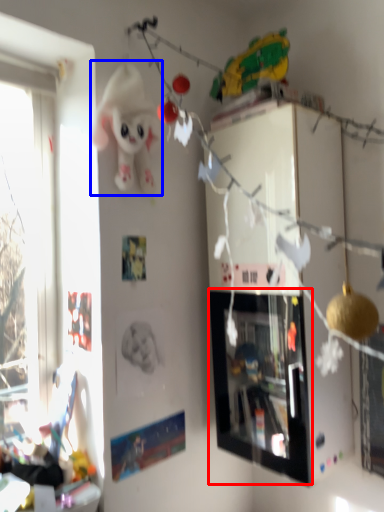
Question: Which of the following is the farthest to the observer, picture frame (highlighted by a red box) or toy (highlighted by a blue box)?

Choices:
 (A) picture frame
 (B) toy

Answer: (A)